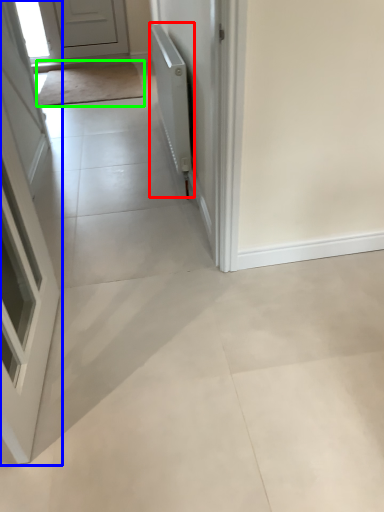
Question: Considering the real-world distances, which object is farthest from radiator (highlighted by a red box)? door (highlighted by a blue box) or mat (highlighted by a green box)?

Choices:
 (A) door
 (B) mat

Answer: (B)